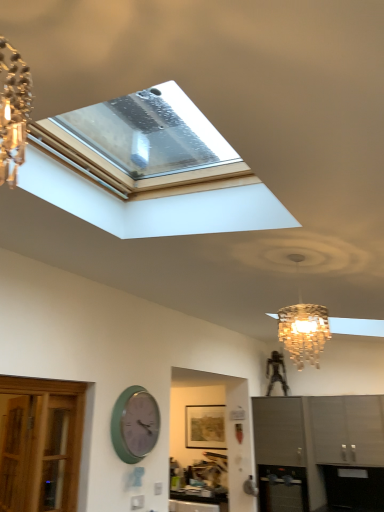
Question: In the image, is matte gray cabinet at lower right, marked as the 2th cabinetry in a right-to-left arrangement, positioned in front of or behind green matte wall clock at lower left?

Choices:
 (A) behind
 (B) front

Answer: (A)

Question: From a real-world perspective, is matte gray cabinet at lower right, which is counted as the 1th cabinetry, starting from the left, physically located above or below green matte wall clock at lower left?

Choices:
 (A) above
 (B) below

Answer: (B)

Question: Considering the real-world distances, which object is farthest from the metallic stainless steel oven at lower center?

Choices:
 (A) green matte wall clock at lower left
 (B) matte gray cabinet at lower right, marked as the 2th cabinetry in a right-to-left arrangement
 (C) satin gray cabinet at lower right, which is counted as the first cabinetry, starting from the right

Answer: (A)

Question: Which object is the farthest from the satin gray cabinet at lower right, which is counted as the first cabinetry, starting from the right?

Choices:
 (A) metallic stainless steel oven at lower center
 (B) green matte wall clock at lower left
 (C) matte gray cabinet at lower right, which is counted as the 1th cabinetry, starting from the left

Answer: (B)